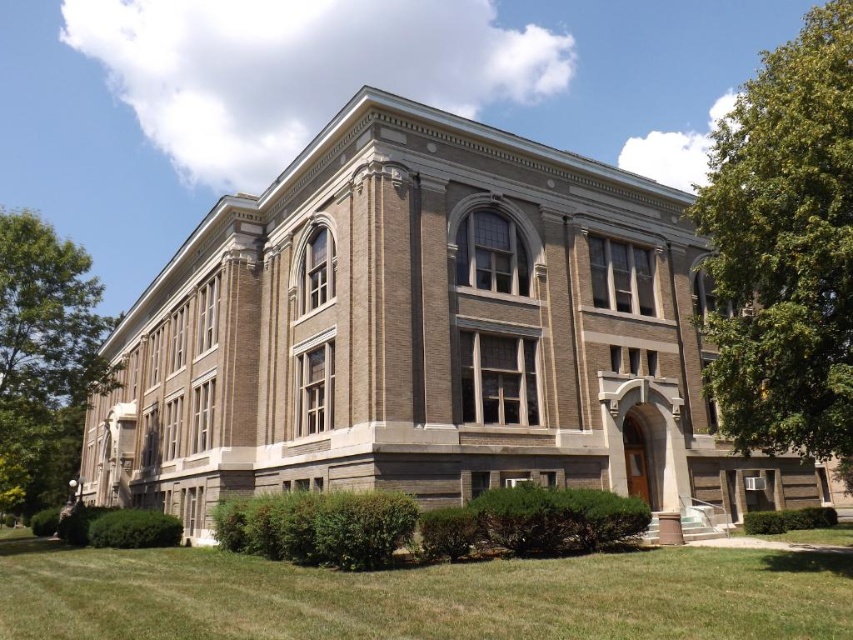
Is green grass at lower center wider than green leafy tree at right?

Incorrect, green grass at lower center's width does not surpass green leafy tree at right's.

Is green grass at lower center behind green leafy tree at right?

No, green grass at lower center is in front of green leafy tree at right.

Does point (665, 570) lie in front of point (780, 426)?

No, (665, 570) is further to viewer.

At what (x,y) coordinates should I click in order to perform the action: click on green grass at lower center. Please return your answer as a coordinate pair (x, y). The height and width of the screenshot is (640, 853). Looking at the image, I should click on click(422, 596).

In the scene shown: Who is more forward, (795, 132) or (21, 216)?

Point (795, 132)

Does point (836, 316) lie in front of point (10, 376)?

Yes, point (836, 316) is closer to viewer.

Locate an element on the screen. green leafy tree at right is located at coordinates (784, 248).

Based on the photo, who is higher up, green grass at lower center or green leafy tree at left?

→ green leafy tree at left is higher up.

Is green grass at lower center below green leafy tree at left?

Yes.

You are a GUI agent. You are given a task and a screenshot of the screen. Output one action in this format:
    pyautogui.click(x=<x>, y=<y>)
    Task: Click on the green grass at lower center
    
    Given the screenshot: What is the action you would take?
    pyautogui.click(x=422, y=596)